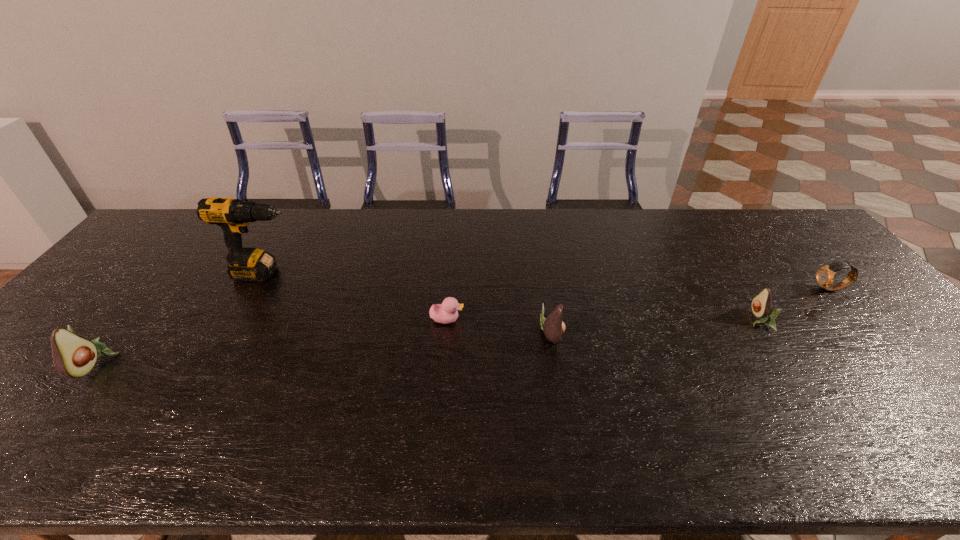
Where is `free space located 0.330m on the face of the rightmost object`? free space located 0.330m on the face of the rightmost object is located at coordinates (701, 289).

Where is `object positioned at the near edge`? Image resolution: width=960 pixels, height=540 pixels. object positioned at the near edge is located at coordinates (73, 356).

This screenshot has width=960, height=540. Find the location of `object that is at the left edge`. object that is at the left edge is located at coordinates (73, 356).

This screenshot has height=540, width=960. Identify the location of object that is at the right edge. (825, 275).

Identify the location of object that is at the near left corner. The width and height of the screenshot is (960, 540). (73, 356).

Identify the location of free space at the far edge of the desktop. The width and height of the screenshot is (960, 540). (416, 231).

You are a GUI agent. You are given a task and a screenshot of the screen. Output one action in this format:
    pyautogui.click(x=<x>, y=<y>)
    Task: Click on the free space at the near edge of the desktop
    This screenshot has height=540, width=960.
    Given the screenshot: What is the action you would take?
    pyautogui.click(x=223, y=416)

In the image, there is a desktop. At what (x,y) coordinates should I click in order to perform the action: click on blank space at the left edge. Please return your answer as a coordinate pair (x, y). The height and width of the screenshot is (540, 960). Looking at the image, I should click on (150, 280).

You are a GUI agent. You are given a task and a screenshot of the screen. Output one action in this format:
    pyautogui.click(x=<x>, y=<y>)
    Task: Click on the free region at the right edge
    Image resolution: width=960 pixels, height=540 pixels.
    Given the screenshot: What is the action you would take?
    pyautogui.click(x=887, y=320)

The height and width of the screenshot is (540, 960). Identify the location of vacant space that's between the third object from left to right and the shortest avocado. (603, 320).